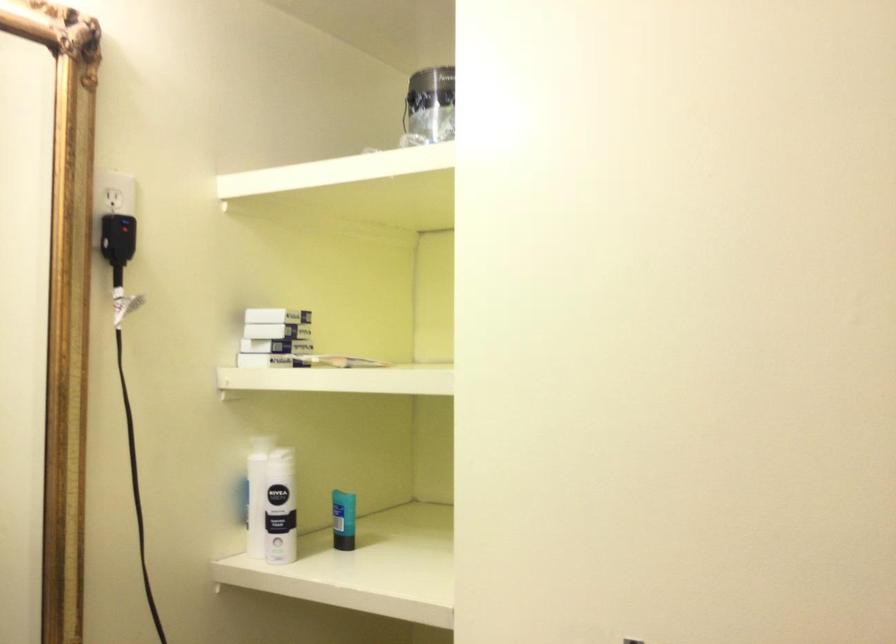
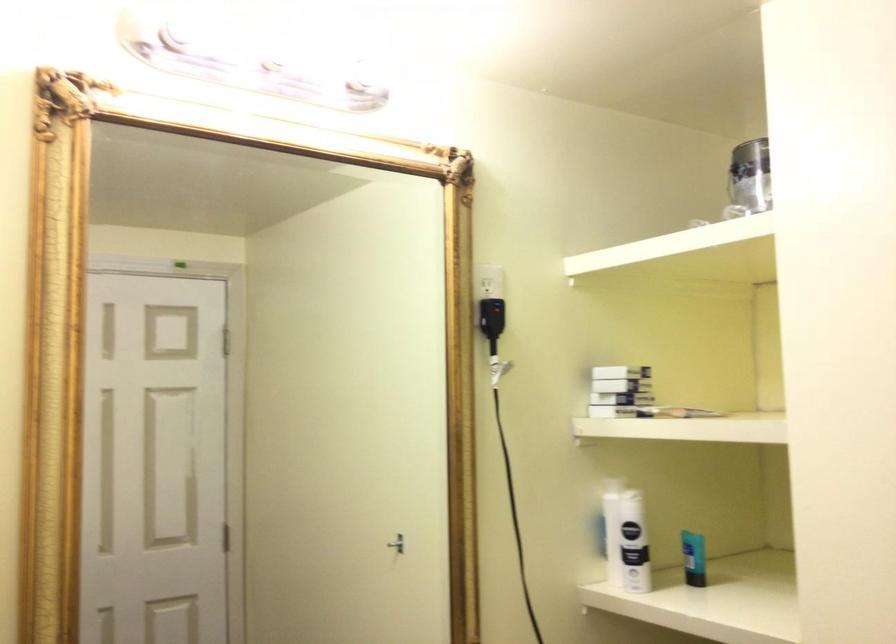
The point at (263, 506) is marked in the first image. Where is the corresponding point in the second image?

(625, 538)